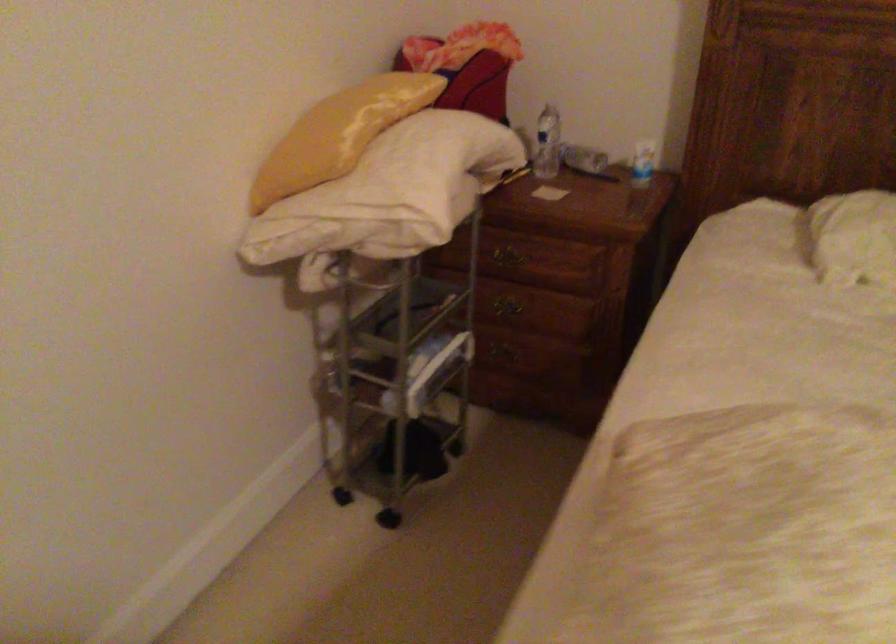
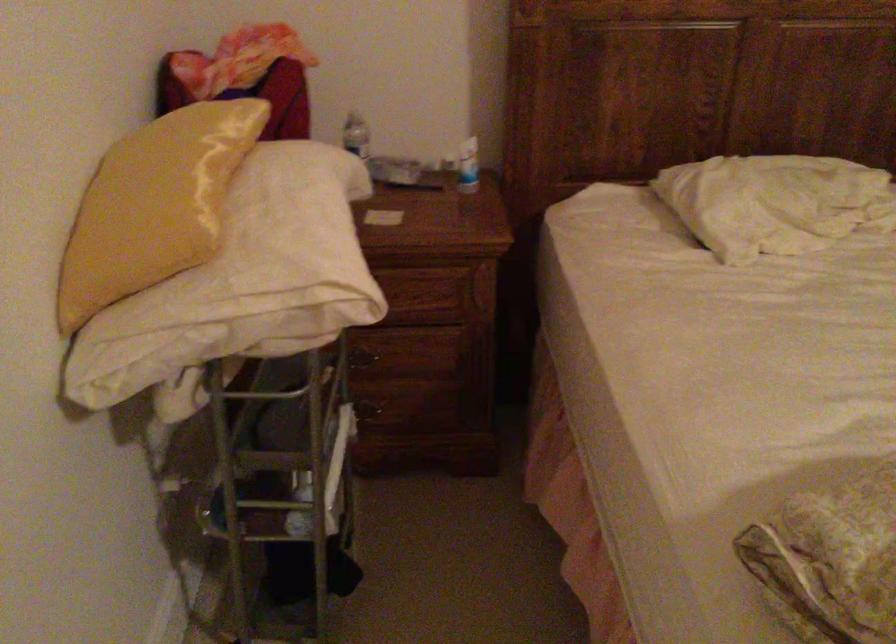
Locate, in the second image, the point that corresponds to (640,162) in the first image.

(468, 166)